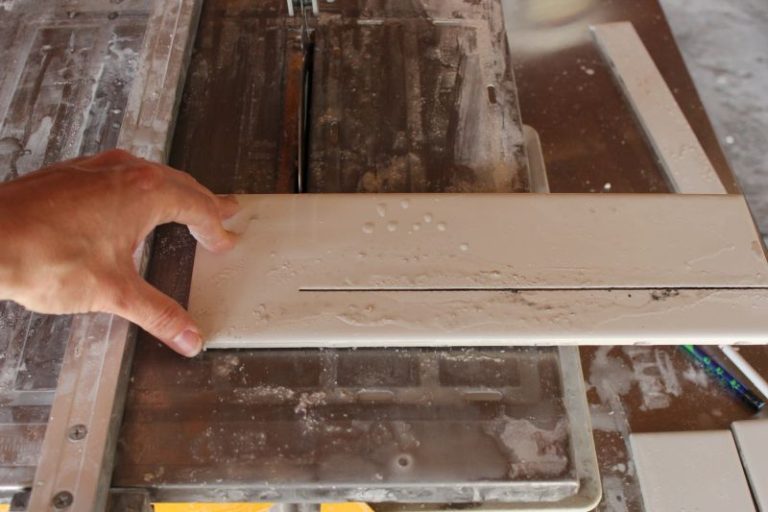
The width and height of the screenshot is (768, 512). What are the coordinates of `tiles cut` in the screenshot? It's located at [x=679, y=481].